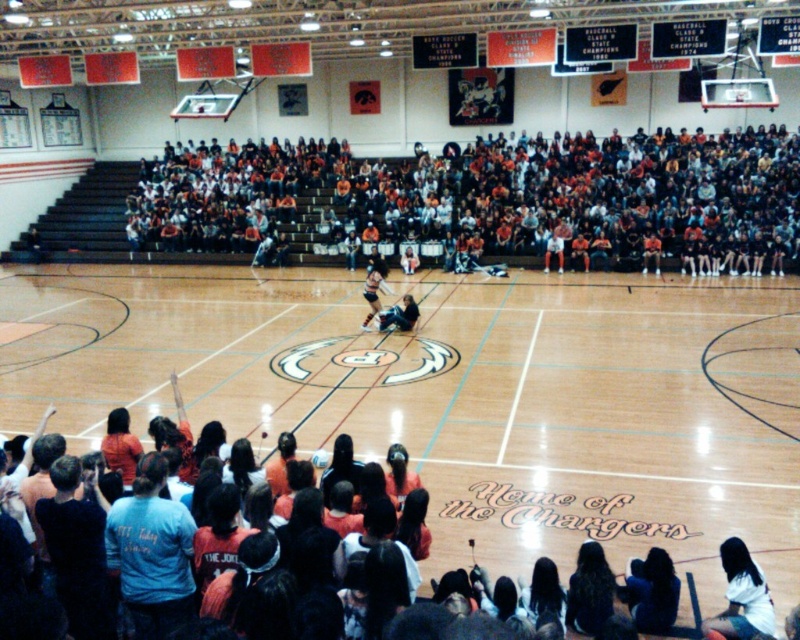
Does white cotton shirt at lower right have a larger size compared to orange jersey at center?

No.

Based on the photo, does white cotton shirt at lower right have a smaller size compared to orange jersey at center?

Yes.

Who is more distant from viewer, [740,620] or [376,262]?

The point [376,262] is more distant.

What are the coordinates of `white cotton shirt at lower right` in the screenshot? It's located at (742, 596).

What do you see at coordinates (398, 316) in the screenshot? Image resolution: width=800 pixels, height=640 pixels. I see `matte black person at center` at bounding box center [398, 316].

Image resolution: width=800 pixels, height=640 pixels. I want to click on matte black person at center, so click(398, 316).

Is point (386, 314) closer to camera compared to point (550, 244)?

Yes, it is.

Find the location of a particular element. matte black person at center is located at coordinates (398, 316).

Is orange casual clothing at upper center bigger than white cotton shirt at lower right?

Yes, orange casual clothing at upper center is bigger than white cotton shirt at lower right.

How far apart are orange casual clothing at upper center and white cotton shirt at lower right?

orange casual clothing at upper center is 68.52 feet away from white cotton shirt at lower right.

Who is more distant from viewer, (x=758, y=182) or (x=736, y=573)?

The point (x=758, y=182) is behind.

Where is `orange casual clothing at upper center`? The image size is (800, 640). orange casual clothing at upper center is located at coordinates (494, 200).